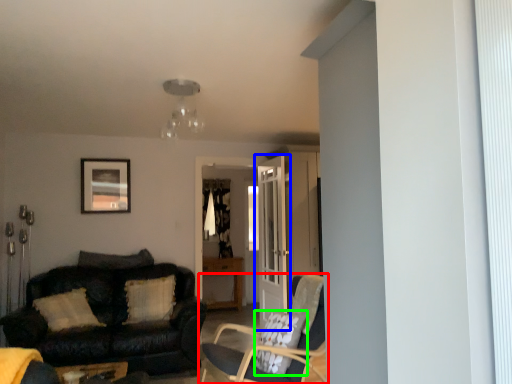
Question: Which object is positioned farthest from chair (highlighted by a red box)? Select from door (highlighted by a blue box) and pillow (highlighted by a green box).

Choices:
 (A) door
 (B) pillow

Answer: (A)